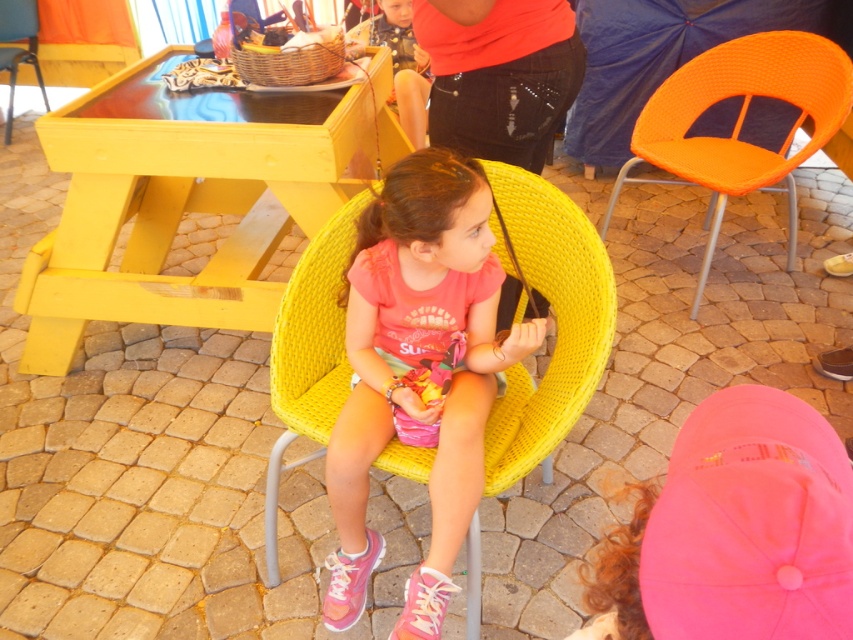
Question: Can you confirm if yellow wicker chair at center is positioned below orange woven umbrella at upper right?

Choices:
 (A) yes
 (B) no

Answer: (A)

Question: Which point is closer to the camera?

Choices:
 (A) (703, 448)
 (B) (424, 451)
 (C) (48, 106)

Answer: (A)

Question: Which point is closer to the camera taking this photo?

Choices:
 (A) (592, 236)
 (B) (642, 618)

Answer: (B)

Question: Does orange woven umbrella at upper right have a greater width compared to yellow woven chair at upper left?

Choices:
 (A) yes
 (B) no

Answer: (A)

Question: From the image, what is the correct spatial relationship of yellow wicker chair at center in relation to orange woven umbrella at upper right?

Choices:
 (A) left
 (B) right

Answer: (A)

Question: Which object appears farthest from the camera in this image?

Choices:
 (A) orange woven chair at upper right
 (B) yellow wicker chair at center
 (C) orange woven umbrella at upper right
 (D) yellow woven chair at upper left

Answer: (D)